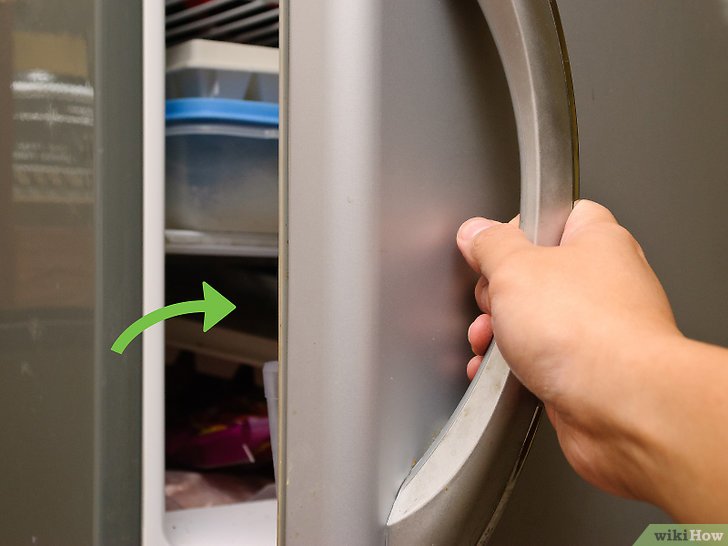
Where is `items inside fridge`? This screenshot has height=546, width=728. items inside fridge is located at coordinates (228, 189), (231, 80), (229, 366), (229, 444).